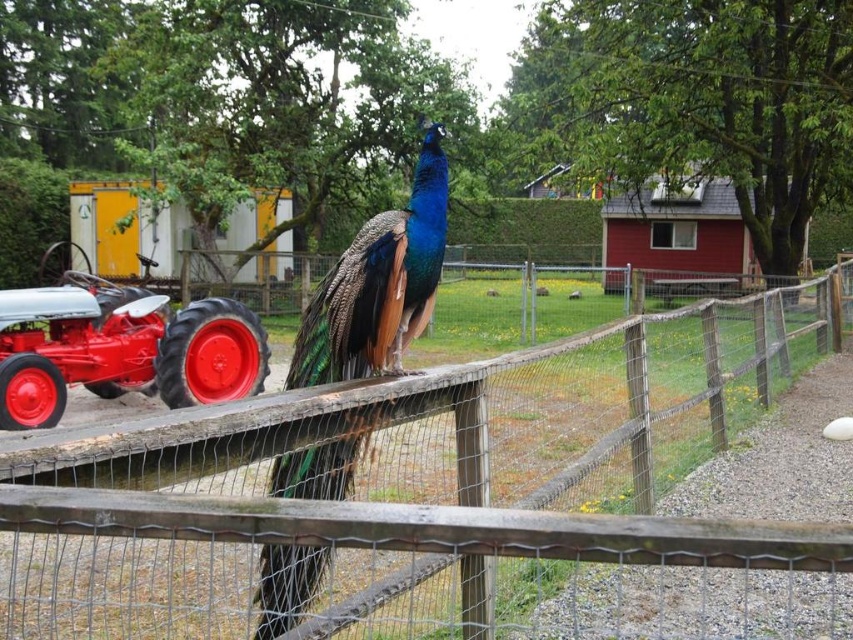
Question: Is wooden fence at center smaller than shiny blue-green peacock at center?

Choices:
 (A) yes
 (B) no

Answer: (B)

Question: Which of the following is the farthest from the observer?

Choices:
 (A) (62, 337)
 (B) (357, 284)

Answer: (A)

Question: Is wooden fence at center smaller than red painted metal tractor at left?

Choices:
 (A) yes
 (B) no

Answer: (B)

Question: Which of the following is the farthest from the observer?

Choices:
 (A) shiny blue-green peacock at center
 (B) red painted metal tractor at left
 (C) wooden fence at center

Answer: (B)

Question: Which of the following is the farthest from the observer?

Choices:
 (A) wooden fence at center
 (B) red painted metal tractor at left

Answer: (B)

Question: Is wooden fence at center in front of shiny blue-green peacock at center?

Choices:
 (A) no
 (B) yes

Answer: (B)